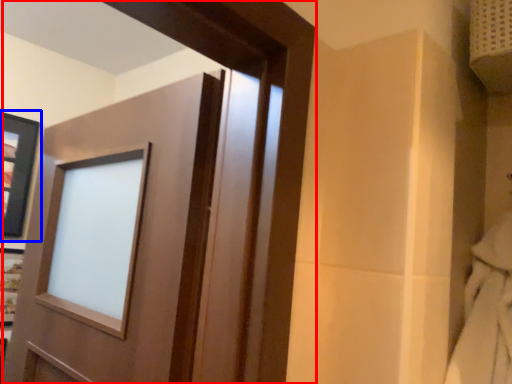
Question: Which of the following is the farthest to the observer, door (highlighted by a red box) or picture frame (highlighted by a blue box)?

Choices:
 (A) door
 (B) picture frame

Answer: (B)